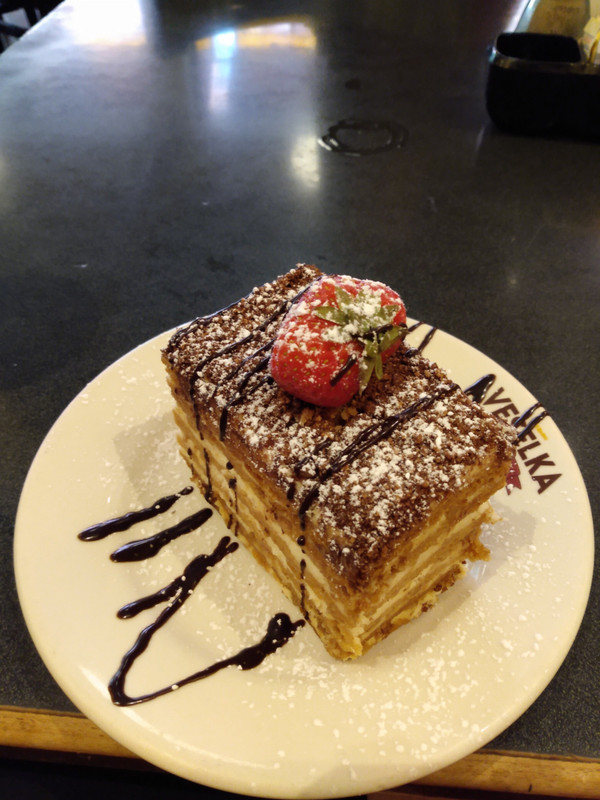
Identify the location of table. The width and height of the screenshot is (600, 800). (552, 722).